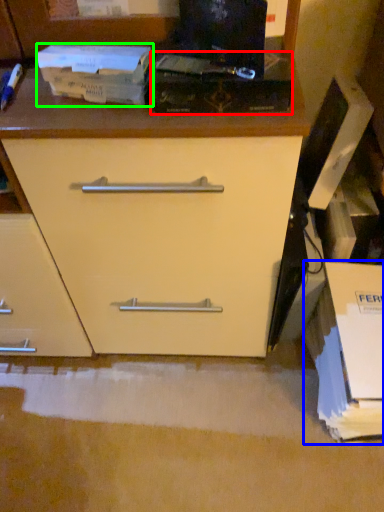
Question: Based on their relative distances, which object is nearer to paperback book (highlighted by a red box)? Choose from cardboard box (highlighted by a blue box) and paperback book (highlighted by a green box).

Choices:
 (A) cardboard box
 (B) paperback book

Answer: (B)